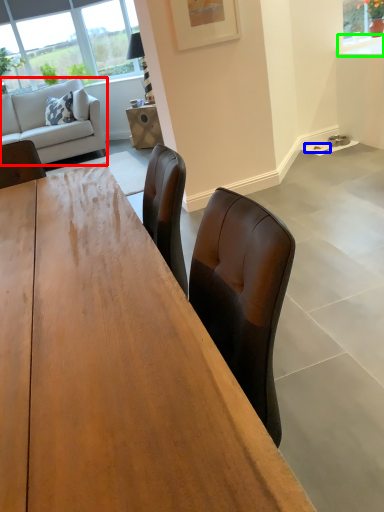
Question: Which is farther away from studio couch (highlighted by a red box)? plate (highlighted by a blue box) or counter top (highlighted by a green box)?

Choices:
 (A) plate
 (B) counter top

Answer: (B)